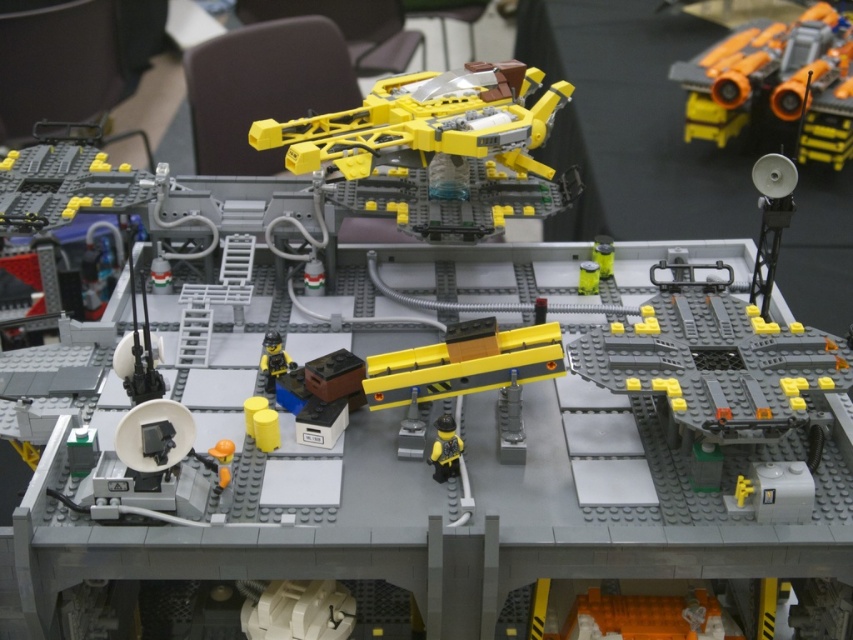
Question: Does orange plastic toy at upper right have a greater width compared to yellow matte figure at center?

Choices:
 (A) yes
 (B) no

Answer: (A)

Question: Which point appears closest to the camera in this image?

Choices:
 (A) (442, 422)
 (B) (767, 22)

Answer: (A)

Question: Which object appears farthest from the camera in this image?

Choices:
 (A) yellow matte figure at center
 (B) orange plastic toy at upper right

Answer: (B)

Question: Does orange plastic toy at upper right have a lesser width compared to yellow matte figure at center?

Choices:
 (A) no
 (B) yes

Answer: (A)

Question: Is orange plastic toy at upper right to the left of yellow matte figure at center from the viewer's perspective?

Choices:
 (A) no
 (B) yes

Answer: (A)